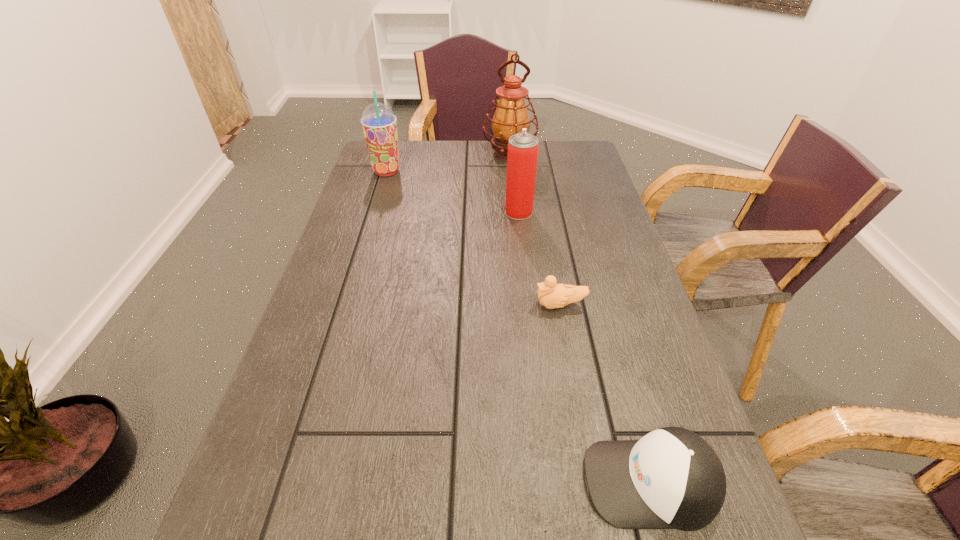
Image resolution: width=960 pixels, height=540 pixels. Find the location of `duckling that is at the right edge`. duckling that is at the right edge is located at coordinates (551, 295).

The width and height of the screenshot is (960, 540). I want to click on object that is at the far left corner, so click(379, 123).

Find the location of `vacant point at the far edge`. vacant point at the far edge is located at coordinates (444, 173).

You are a GUI agent. You are given a task and a screenshot of the screen. Output one action in this format:
    pyautogui.click(x=<x>, y=<y>)
    Task: Click on the free space at the left edge
    The width and height of the screenshot is (960, 540).
    Given the screenshot: What is the action you would take?
    pyautogui.click(x=333, y=303)

I want to click on vacant space at the right edge of the desktop, so click(x=602, y=202).

Locate an element on the screen. The width and height of the screenshot is (960, 540). free space at the far right corner is located at coordinates (580, 148).

This screenshot has height=540, width=960. Find the location of `free spot between the third farthest object and the smoothie`. free spot between the third farthest object and the smoothie is located at coordinates (453, 192).

Locate an element on the screen. unoccupied area between the leftmost object and the third nearest object is located at coordinates (453, 192).

Find the location of `vacant region between the cap and the duckling`. vacant region between the cap and the duckling is located at coordinates (606, 394).

Identify the location of vacant space that's between the second nearest object and the tallest object. (535, 230).